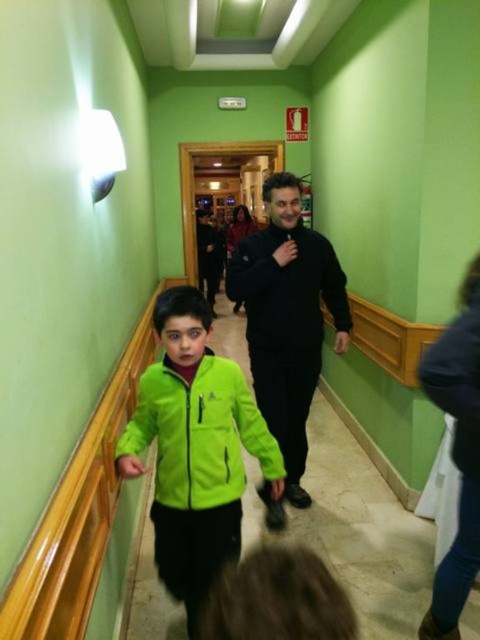
Question: Which of these objects is positioned closest to the neon green jacket at center?

Choices:
 (A) black matte sweatshirt at center
 (B) black matte jacket at center
 (C) green fleece jacket at lower left

Answer: (C)

Question: Which point is farther to the camera?

Choices:
 (A) (314, 298)
 (B) (250, 449)
 (C) (247, 262)

Answer: (A)

Question: Can you confirm if black matte jacket at center is smaller than black matte sweatshirt at center?

Choices:
 (A) yes
 (B) no

Answer: (B)

Question: Can you confirm if green fleece jacket at lower left is positioned to the left of black matte sweatshirt at center?

Choices:
 (A) yes
 (B) no

Answer: (A)

Question: Is the position of neon green jacket at center more distant than that of black matte sweatshirt at center?

Choices:
 (A) no
 (B) yes

Answer: (A)

Question: Based on their relative distances, which object is nearer to the neon green jacket at center?

Choices:
 (A) black matte jacket at center
 (B) black matte sweatshirt at center
 (C) green fleece jacket at lower left

Answer: (C)